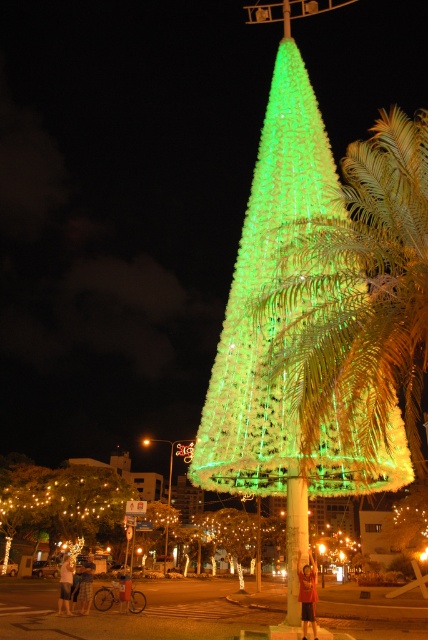
Question: Does green illuminated cone at center appear on the left side of red cotton shirt at center?

Choices:
 (A) yes
 (B) no

Answer: (A)

Question: Does green metallic palm tree at center appear on the right side of denim shorts at lower left?

Choices:
 (A) yes
 (B) no

Answer: (A)

Question: Which point appears closest to the camera in this image?

Choices:
 (A) (213, 515)
 (B) (308, 563)
 (C) (291, 608)
 (D) (395, 189)

Answer: (D)

Question: Which object is closer to the camera taking this photo?

Choices:
 (A) green metallic palm tree at center
 (B) green illuminated cone at center
 (C) red cotton shirt at center

Answer: (A)

Question: Which of these objects is positioned farthest from the light brown shorts at lower left?

Choices:
 (A) green plastic pole at center
 (B) illuminated string lights at lower left

Answer: (A)

Question: Considering the relative positions of green metallic palm tree at center and green plastic pole at center in the image provided, where is green metallic palm tree at center located with respect to green plastic pole at center?

Choices:
 (A) left
 (B) right

Answer: (B)